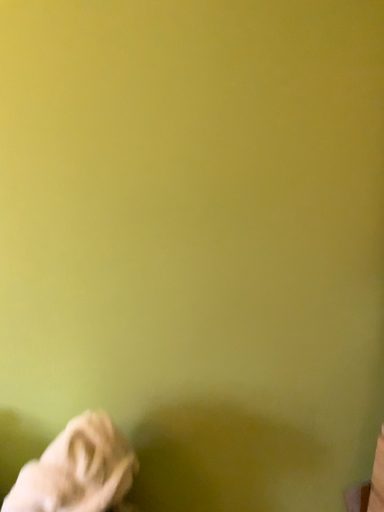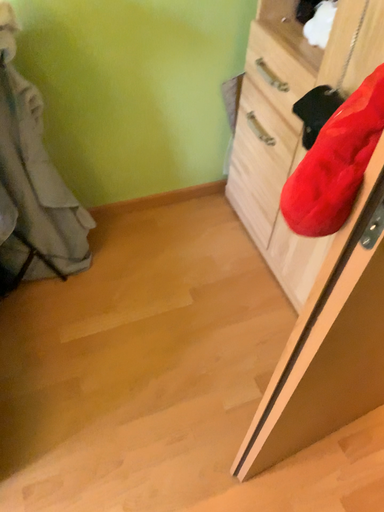
Question: Which way did the camera rotate in the video?

Choices:
 (A) rotated right
 (B) rotated left

Answer: (A)